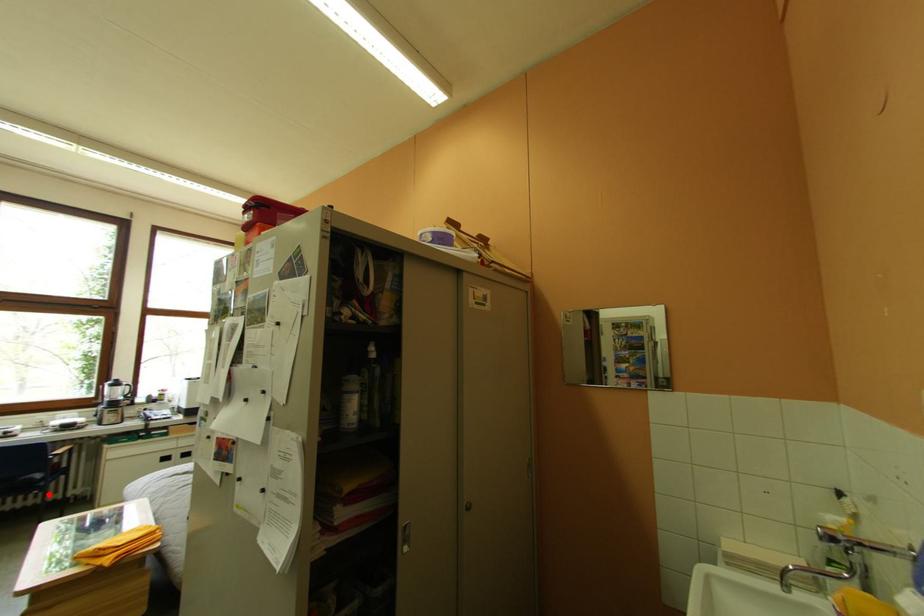
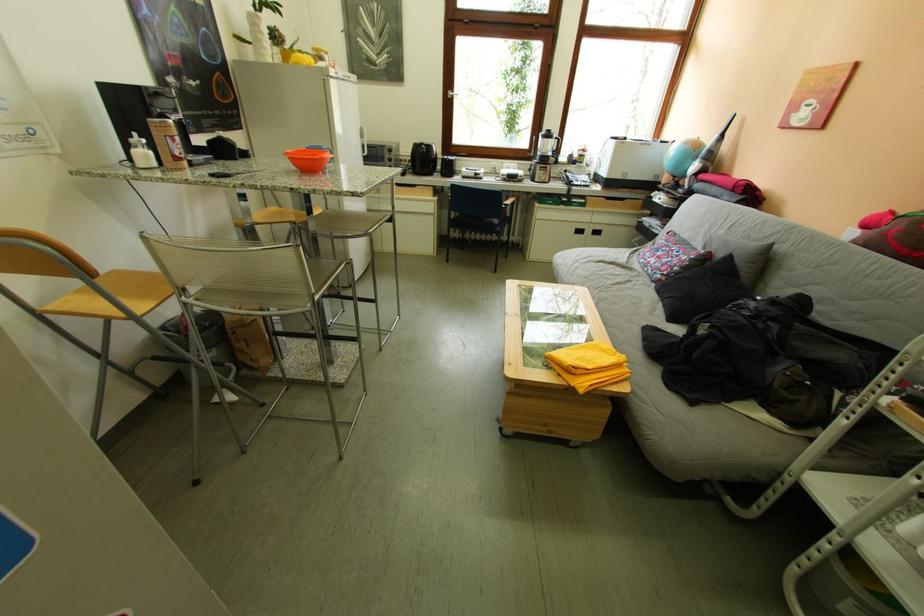
In the second image, find the point that corresponds to the highlighted location in the first image.

(507, 238)